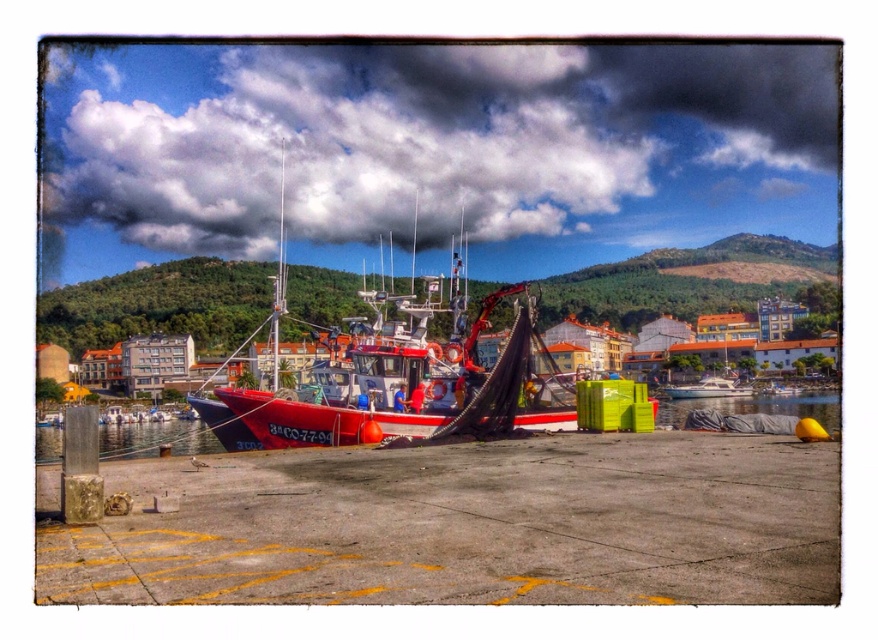
Question: Observing the image, what is the correct spatial positioning of black tarp at lower right in reference to white glossy boat at center?

Choices:
 (A) left
 (B) right

Answer: (A)

Question: Can you confirm if black tarp at lower right is thinner than white glossy boat at center?

Choices:
 (A) no
 (B) yes

Answer: (A)

Question: Is black tarp at lower right bigger than white glossy boat at center?

Choices:
 (A) no
 (B) yes

Answer: (B)

Question: Which object appears closest to the camera in this image?

Choices:
 (A) white glossy boat at center
 (B) black tarp at lower right

Answer: (B)